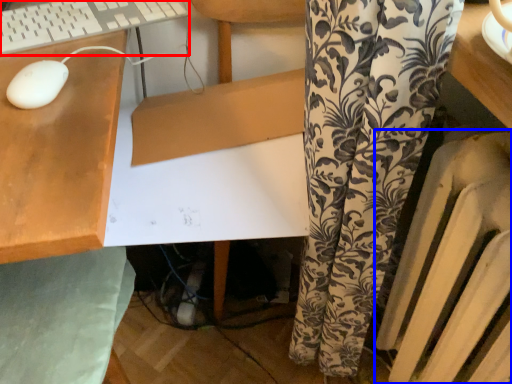
Question: Which of the following is the farthest to the observer, computer keyboard (highlighted by a red box) or radiator (highlighted by a blue box)?

Choices:
 (A) computer keyboard
 (B) radiator

Answer: (A)